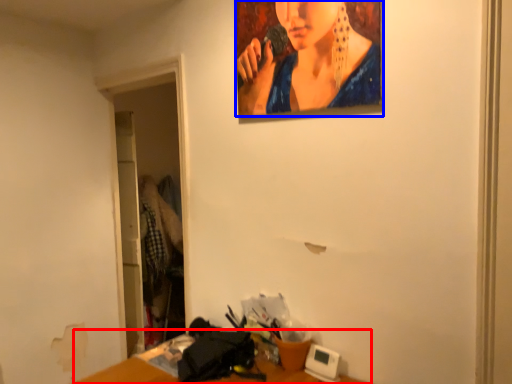
Question: Among these objects, which one is nearest to the camera, table (highlighted by a red box) or person (highlighted by a blue box)?

Choices:
 (A) table
 (B) person

Answer: (A)